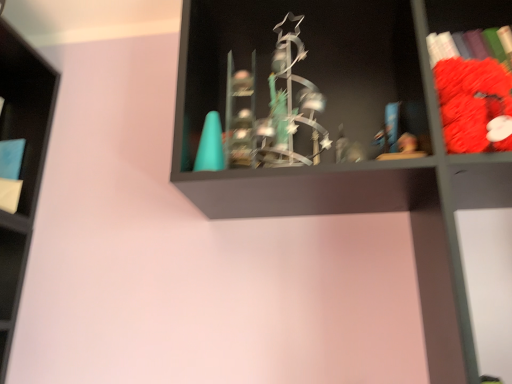
Question: Could you tell me if metallic statue at center is facing blue matte book at left, placed as the 1th book when sorted from left to right?

Choices:
 (A) yes
 (B) no

Answer: (B)

Question: Does metallic statue at center come behind blue matte book at left, which is counted as the second book, starting from the front?

Choices:
 (A) yes
 (B) no

Answer: (B)

Question: Is metallic statue at center next to blue matte book at left, which is the 2th book in right-to-left order?

Choices:
 (A) yes
 (B) no

Answer: (B)

Question: Is metallic statue at center shorter than blue matte book at left, which is counted as the second book, starting from the front?

Choices:
 (A) no
 (B) yes

Answer: (A)

Question: From the image's perspective, is metallic statue at center above blue matte book at left, which is the 2th book in right-to-left order?

Choices:
 (A) no
 (B) yes

Answer: (A)

Question: Is blue matte book at left, which is counted as the second book, starting from the front, completely or partially inside metallic statue at center?

Choices:
 (A) yes
 (B) no

Answer: (B)

Question: Is velvet red plush toy at right, acting as the first book starting from the right, not close to blue matte book at left, placed as the 1th book when sorted from left to right?

Choices:
 (A) no
 (B) yes

Answer: (B)

Question: From the image's perspective, would you say velvet red plush toy at right, placed as the second book when sorted from left to right, is positioned over blue matte book at left, positioned as the 1th book in back-to-front order?

Choices:
 (A) yes
 (B) no

Answer: (A)

Question: From a real-world perspective, is velvet red plush toy at right, acting as the second book starting from the back, physically below blue matte book at left, placed as the 1th book when sorted from left to right?

Choices:
 (A) no
 (B) yes

Answer: (B)

Question: Could you tell me if velvet red plush toy at right, acting as the second book starting from the back, is turned towards blue matte book at left, which is counted as the second book, starting from the front?

Choices:
 (A) yes
 (B) no

Answer: (B)

Question: Is velvet red plush toy at right, acting as the first book starting from the right, next to blue matte book at left, which is counted as the second book, starting from the front, and touching it?

Choices:
 (A) yes
 (B) no

Answer: (B)

Question: Considering the relative sizes of velvet red plush toy at right, acting as the first book starting from the right, and blue matte book at left, which is the 2th book in right-to-left order, in the image provided, is velvet red plush toy at right, acting as the first book starting from the right, thinner than blue matte book at left, which is the 2th book in right-to-left order,?

Choices:
 (A) no
 (B) yes

Answer: (A)

Question: Considering the relative sizes of velvet red plush toy at right, placed as the second book when sorted from left to right, and metallic statue at center in the image provided, is velvet red plush toy at right, placed as the second book when sorted from left to right, shorter than metallic statue at center?

Choices:
 (A) yes
 (B) no

Answer: (A)